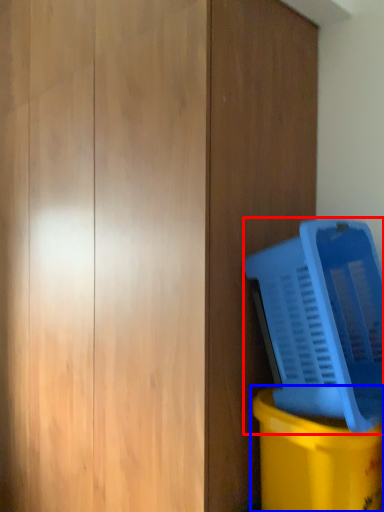
Question: Which point is closer to the camera, water cooler (highlighted by a red box) or waste container (highlighted by a blue box)?

Choices:
 (A) water cooler
 (B) waste container

Answer: (A)